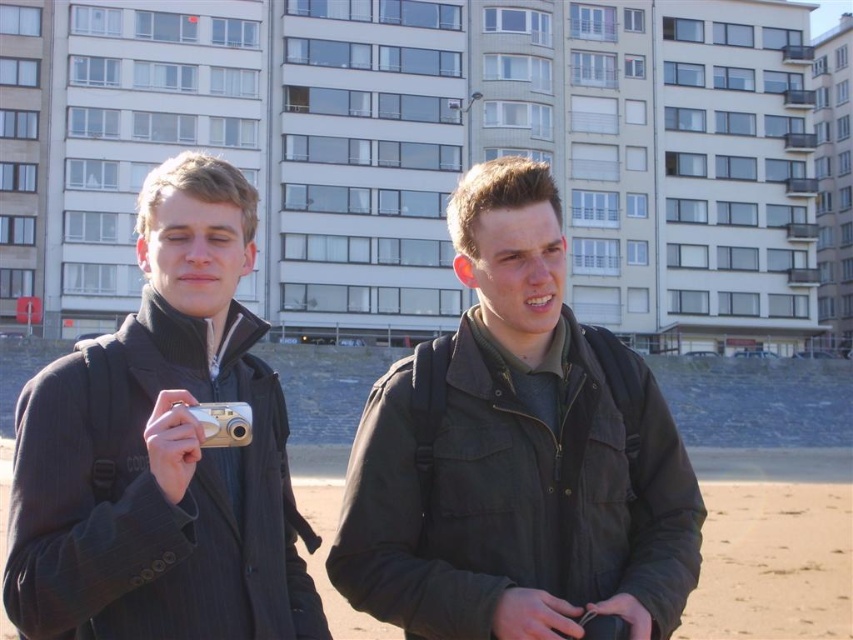
Question: Is black matte jacket at center below matte black jacket at center?

Choices:
 (A) yes
 (B) no

Answer: (A)

Question: Which of these objects is positioned closest to the matte black jacket at center?

Choices:
 (A) black matte jacket at center
 (B) silver metallic camera at center
 (C) sandy beach at lower center

Answer: (B)

Question: Estimate the real-world distances between objects in this image. Which object is farther from the black matte jacket at center?

Choices:
 (A) sandy beach at lower center
 (B) silver metallic camera at center
 (C) matte black jacket at center

Answer: (A)

Question: In this image, where is sandy beach at lower center located relative to silver metallic camera at center?

Choices:
 (A) below
 (B) above

Answer: (A)

Question: Is matte black jacket at center positioned in front of silver metallic camera at center?

Choices:
 (A) no
 (B) yes

Answer: (B)

Question: Estimate the real-world distances between objects in this image. Which object is closer to the sandy beach at lower center?

Choices:
 (A) silver metallic camera at center
 (B) black matte jacket at center
 (C) matte black jacket at center

Answer: (C)